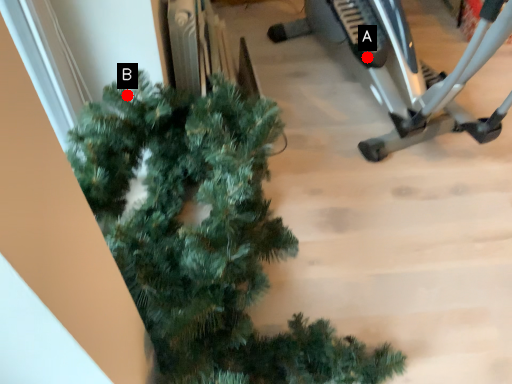
Question: Two points are circled on the image, labeled by A and B beside each circle. Among these points, which one is farthest from the camera?

Choices:
 (A) A is further
 (B) B is further

Answer: (A)